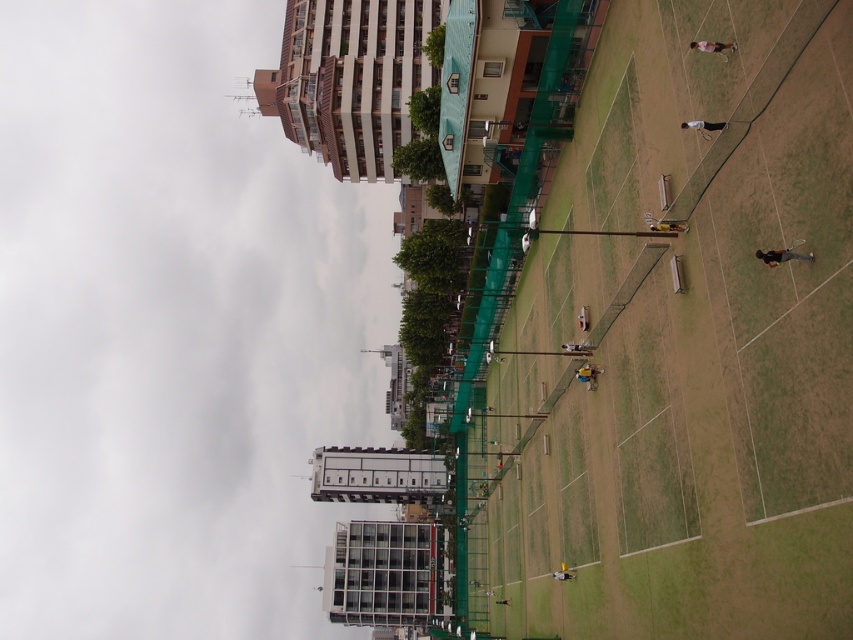
Question: Can you confirm if light brown leather jacket at upper right is positioned above white fabric shirt at lower center?

Choices:
 (A) yes
 (B) no

Answer: (A)

Question: Which point is farther from the camera taking this photo?

Choices:
 (A) (717, 125)
 (B) (564, 564)

Answer: (B)

Question: Estimate the real-world distances between objects in this image. Which object is farther from the light brown wooden bench at lower center?

Choices:
 (A) green grass at center
 (B) light brown leather jacket at upper right
 (C) yellow fabric person at center

Answer: (B)

Question: Can you confirm if white matte tennis racket at upper right is positioned to the left of light brown wooden bench at lower center?

Choices:
 (A) no
 (B) yes

Answer: (A)

Question: Does light blue fabric shirt at center appear over light brown wooden bench at lower center?

Choices:
 (A) no
 (B) yes

Answer: (B)

Question: Which point is farther from the camera taking this photo?

Choices:
 (A) tap(776, 252)
 (B) tap(561, 564)
 (C) tap(723, 60)

Answer: (B)